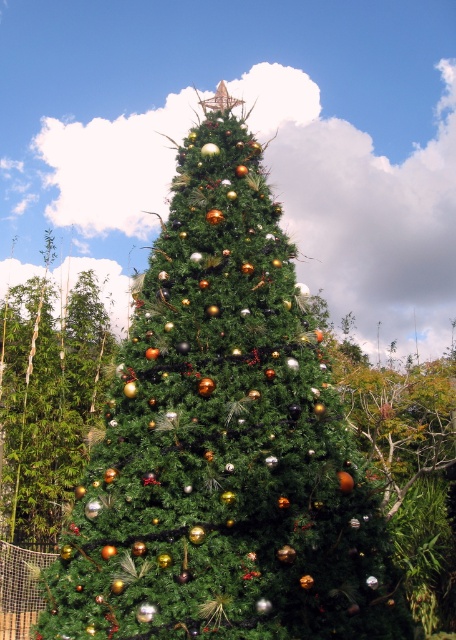
Question: Among these points, which one is farthest from the camera?

Choices:
 (A) (258, 620)
 (B) (32, 323)

Answer: (B)

Question: Which of the following is the closest to the observer?

Choices:
 (A) green matte christmas tree at center
 (B) shiny gold ornaments at left

Answer: (A)

Question: Can you confirm if green matte christmas tree at center is positioned to the right of shiny gold ornaments at left?

Choices:
 (A) no
 (B) yes

Answer: (B)

Question: Can you confirm if green matte christmas tree at center is positioned to the left of shiny gold ornaments at left?

Choices:
 (A) yes
 (B) no

Answer: (B)

Question: Which point is farther to the camera?

Choices:
 (A) green matte christmas tree at center
 (B) shiny gold ornaments at left

Answer: (B)

Question: In this image, where is green matte christmas tree at center located relative to shiny gold ornaments at left?

Choices:
 (A) above
 (B) below

Answer: (A)